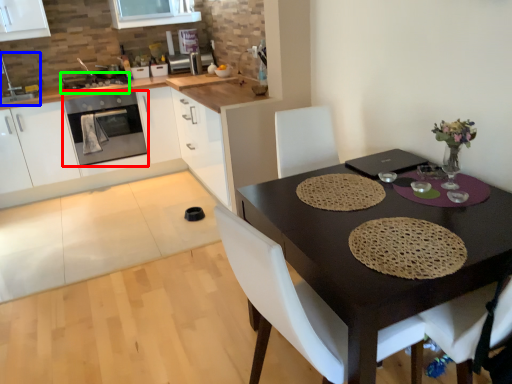
Question: Based on their relative distances, which object is farther from kitchen appliance (highlighted by a red box)? Choose from sink (highlighted by a blue box) and appliance (highlighted by a green box).

Choices:
 (A) sink
 (B) appliance

Answer: (A)